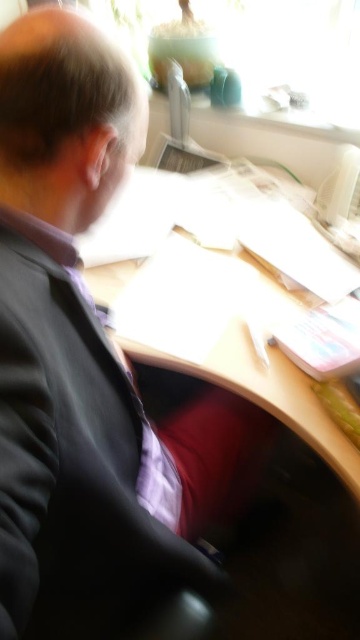
You are an office assistant who needs to clean the desk. The black matte suit at center is currently blocking access to the wooden desk at center. Can you move the suit to clear the desk?

The black matte suit at center is in front of the wooden desk at center, so you can move it to clear the desk.

Consider the image. You are organizing a photo shoot and need to ensure the black matte suit at center and wooden desk at center are both visible in the frame. Given their sizes, which object should you prioritize positioning closer to the camera to ensure both are fully visible?

The black matte suit at center occupies less space than the wooden desk at center, so you should prioritize positioning the wooden desk at center closer to the camera to ensure both are fully visible.

You are an office assistant who needs to adjust the lighting in the workspace. The black matte suit at center and the wooden desk at center are in your view. Which object is positioned lower in the image?

The black matte suit at center is located below the wooden desk at center, so it is positioned lower in the image.